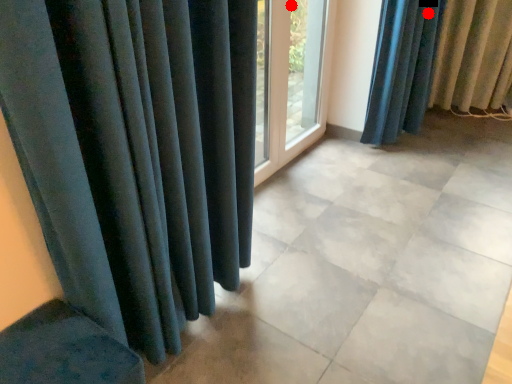
Question: Two points are circled on the image, labeled by A and B beside each circle. Which of the following is the farthest from the observer?

Choices:
 (A) A is further
 (B) B is further

Answer: (A)